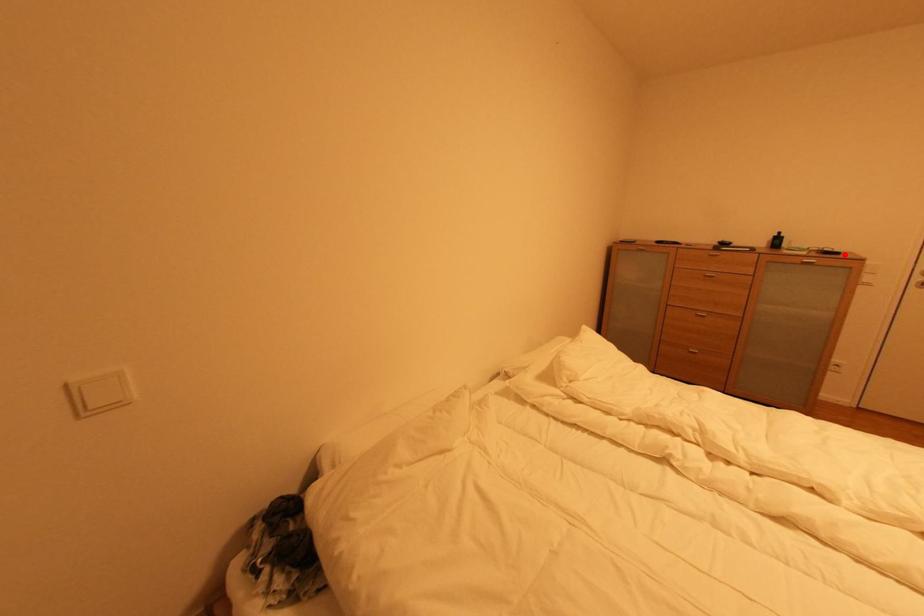
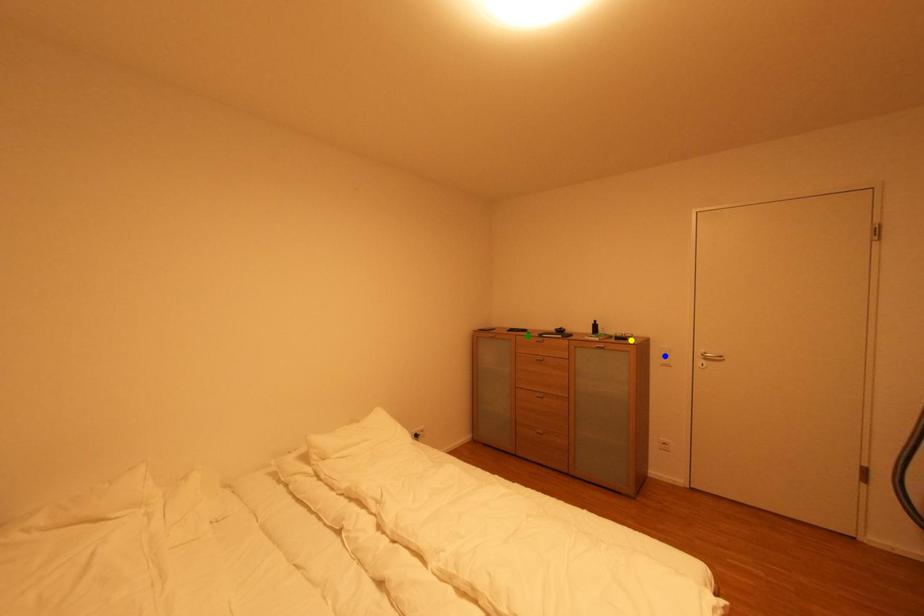
Question: I am providing you with two images of the same scene from different viewpoints. A red point is marked on the first image. You are given multiple points on the second image. Which spot in image 2 lines up with the point in image 1?

Choices:
 (A) yellow point
 (B) blue point
 (C) green point

Answer: (A)